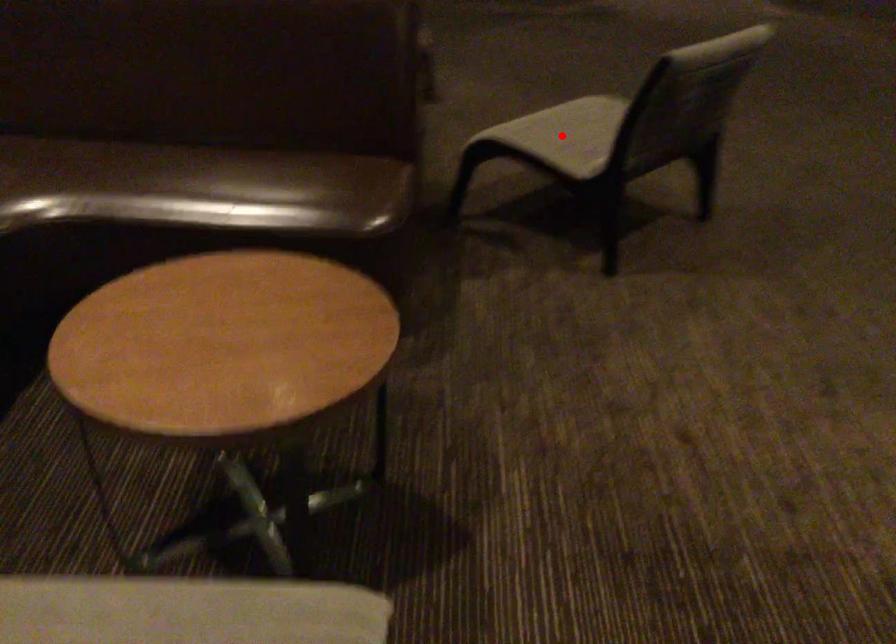
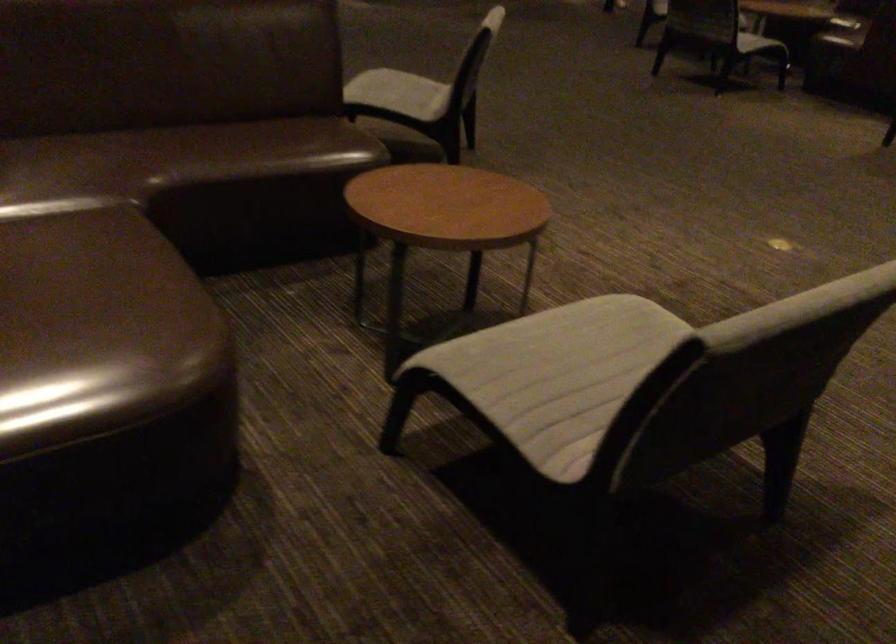
Question: I am providing you with two images of the same scene from different viewpoints. In image1, a red point is highlighted. Considering the same 3D point in image2, which of the following is correct?

Choices:
 (A) It is closer
 (B) It is farther

Answer: (B)